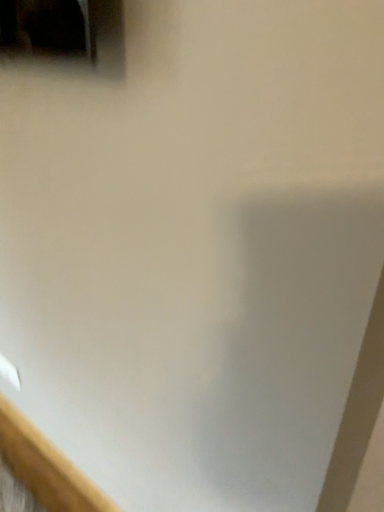
Where is `wooden table at lower left`? wooden table at lower left is located at coordinates (46, 467).

This screenshot has width=384, height=512. What do you see at coordinates (46, 467) in the screenshot? I see `wooden table at lower left` at bounding box center [46, 467].

The image size is (384, 512). In order to click on wooden table at lower left in this screenshot , I will do `click(46, 467)`.